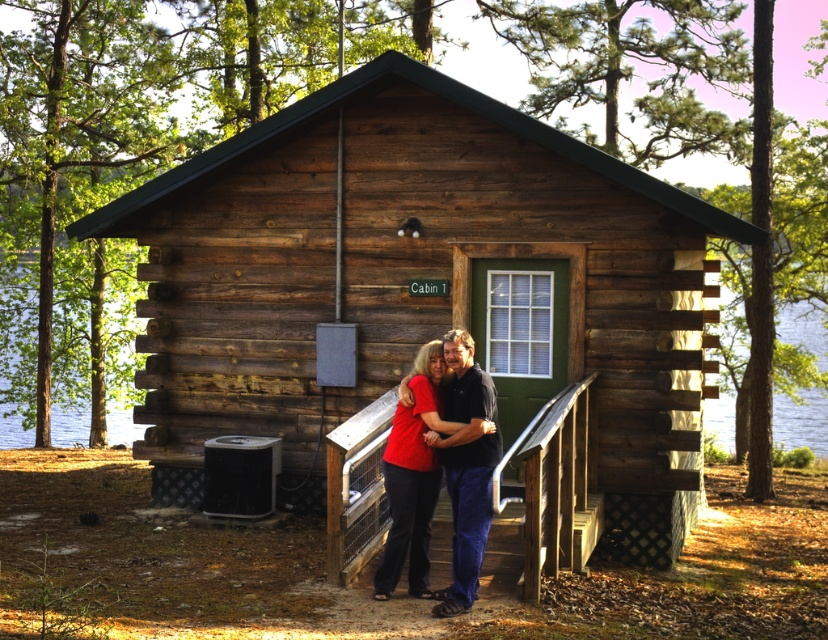
You are standing on the porch of the cabin and want to take a photo of the transparent water at cabin left and the matte black couple at center. Which object should you focus on first if you want to capture both in the same frame?

You should focus on the matte black couple at center first because the transparent water at cabin left is located above them, so adjusting the camera to include the area above the couple will ensure both are in the frame.

You are a photographer planning to take a portrait of the matte black couple at center while ensuring the wooden cabin at center is visible in the background. Based on their relative heights, will the cabin appear larger than the couple in the photo?

The wooden cabin at center is taller than the matte black couple at center, so in the photo, the cabin will appear larger than the couple.

You are standing at the edge of the lake near the cabin and want to take a photo of the two points marked in the scene. Which point, point [102,364] or point [492,444], will appear closer to the camera in the photo?

Point [102,364] will appear closer to the camera in the photo because it is further to the camera than point [492,444].